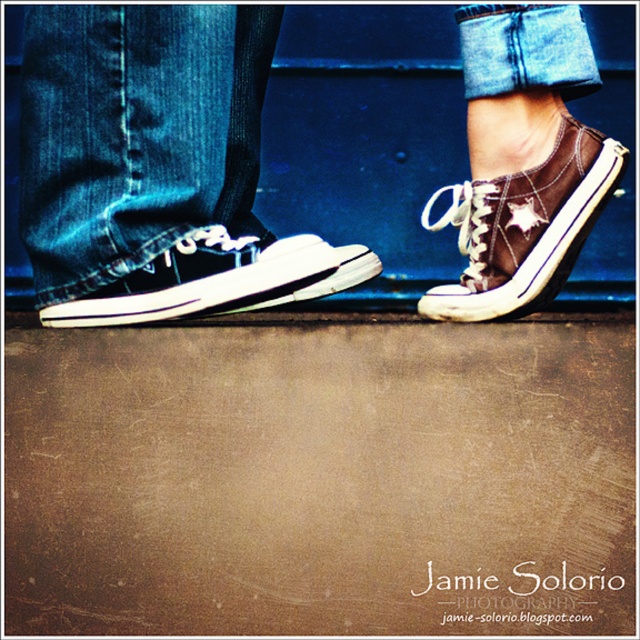
Question: Which of these objects is positioned closest to the matte black sneakers at lower left?

Choices:
 (A) matte black sneaker at center
 (B) brown canvas shoe at right

Answer: (A)

Question: Does matte black sneakers at lower left lie behind brown canvas shoe at right?

Choices:
 (A) yes
 (B) no

Answer: (B)

Question: Does matte black sneakers at lower left appear on the right side of matte black sneaker at center?

Choices:
 (A) yes
 (B) no

Answer: (A)

Question: Which object is farther from the camera taking this photo?

Choices:
 (A) matte black sneakers at lower left
 (B) matte black sneaker at center

Answer: (A)

Question: Which of the following is the closest to the observer?

Choices:
 (A) matte black sneakers at lower left
 (B) brown canvas shoe at right

Answer: (A)

Question: Does brown canvas shoe at right lie in front of matte black sneaker at center?

Choices:
 (A) yes
 (B) no

Answer: (B)